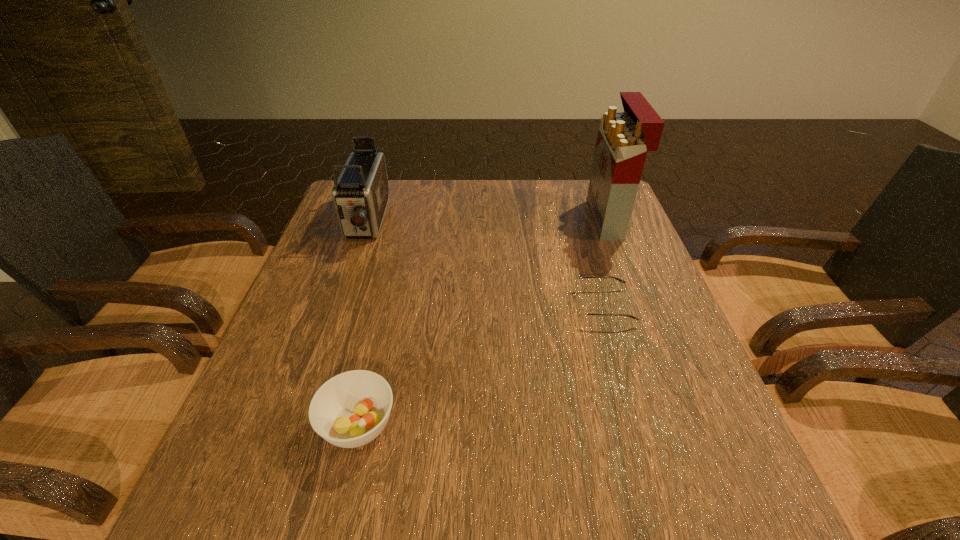
The image size is (960, 540). What are the coordinates of `the tallest object` in the screenshot? It's located at (624, 138).

Where is `the third shortest object`? Image resolution: width=960 pixels, height=540 pixels. the third shortest object is located at coordinates (360, 194).

Locate an element on the screen. the nearest object is located at coordinates coord(351,409).

In order to click on soup bowl in this screenshot , I will do `click(351, 409)`.

The width and height of the screenshot is (960, 540). I want to click on the third farthest object, so click(x=582, y=312).

At what (x,y) coordinates should I click in order to perform the action: click on the shortest object. Please return your answer as a coordinate pair (x, y). The height and width of the screenshot is (540, 960). Looking at the image, I should click on (582, 312).

Locate an element on the screen. This screenshot has width=960, height=540. vacant space located with the lid open on the cigarette case is located at coordinates (572, 220).

Identify the location of free space located 0.050m with the lid open on the cigarette case. (575, 220).

Identify the location of vacant region located 0.140m with the lid open on the cigarette case. (544, 220).

This screenshot has height=540, width=960. I want to click on vacant space located 0.360m at the lens of the camcorder, so click(x=318, y=361).